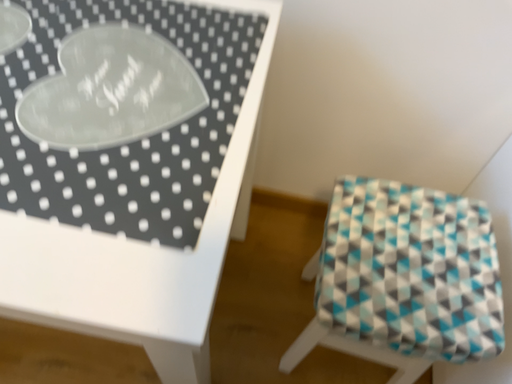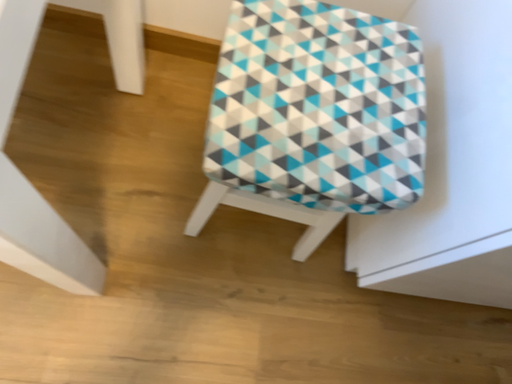
Question: How did the camera likely rotate when shooting the video?

Choices:
 (A) rotated right
 (B) rotated left

Answer: (A)